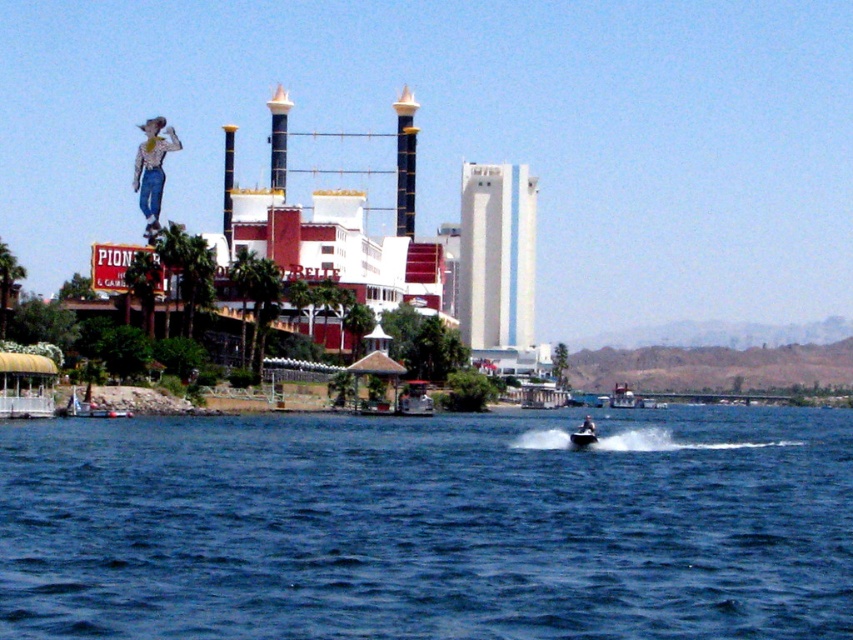
Based on the photo, is denim jeans cowboy at upper left smaller than metallic silver jet ski at lower center?

Actually, denim jeans cowboy at upper left might be larger than metallic silver jet ski at lower center.

Between denim jeans cowboy at upper left and metallic silver jet ski at lower center, which one has less height?

metallic silver jet ski at lower center is shorter.

Locate an element on the screen. denim jeans cowboy at upper left is located at coordinates (152, 170).

Find the location of a particular element. This screenshot has height=640, width=853. denim jeans cowboy at upper left is located at coordinates (152, 170).

Is denim jeans cowboy at upper left thinner than dark blue fabric boat at lower right?

Indeed, denim jeans cowboy at upper left has a lesser width compared to dark blue fabric boat at lower right.

Which is below, denim jeans cowboy at upper left or dark blue fabric boat at lower right?

Answer: Positioned lower is dark blue fabric boat at lower right.

This screenshot has width=853, height=640. Find the location of `denim jeans cowboy at upper left`. denim jeans cowboy at upper left is located at coordinates (152, 170).

How far apart are blue water at center and denim jeans cowboy at upper left?

blue water at center is 78.61 meters away from denim jeans cowboy at upper left.

Who is more forward, (169,477) or (160,150)?

Point (169,477)

You are a GUI agent. You are given a task and a screenshot of the screen. Output one action in this format:
    pyautogui.click(x=<x>, y=<y>)
    Task: Click on the blue water at center
    The height and width of the screenshot is (640, 853).
    Given the screenshot: What is the action you would take?
    pyautogui.click(x=428, y=525)

Find the location of a particular element. The height and width of the screenshot is (640, 853). blue water at center is located at coordinates [428, 525].